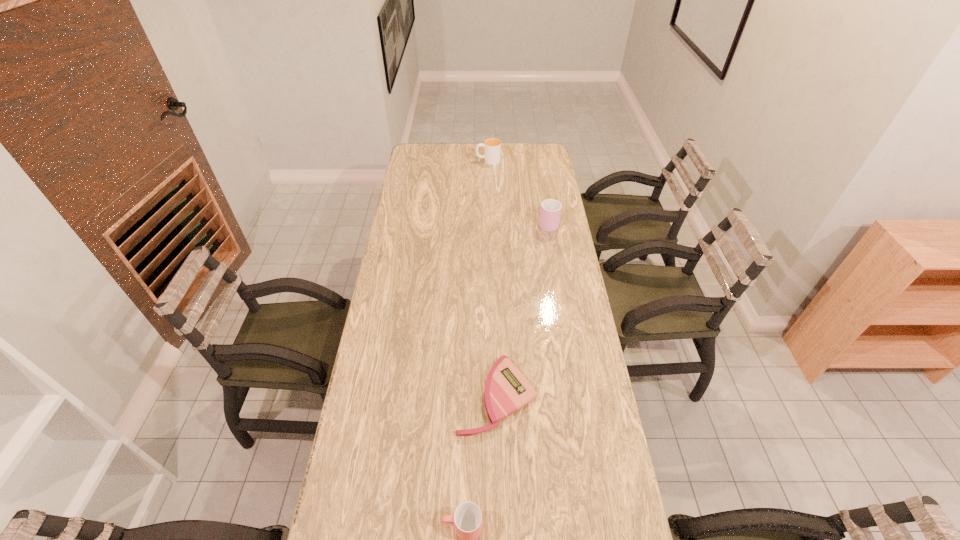
Locate an element on the screen. unoccupied position between the second nearest cup and the farthest cup is located at coordinates (518, 192).

Find the location of `vacant space that is in between the wristlet and the second farthest object`. vacant space that is in between the wristlet and the second farthest object is located at coordinates (522, 309).

This screenshot has height=540, width=960. I want to click on empty space that is in between the wristlet and the rightmost object, so click(x=522, y=309).

Identify the location of vacant area between the farthest object and the rightmost object. (518, 192).

Find the location of a particular element. object that is the closest to the rightmost object is located at coordinates (492, 146).

You are a GUI agent. You are given a task and a screenshot of the screen. Output one action in this format:
    pyautogui.click(x=<x>, y=<y>)
    Task: Click on the object that stands as the closest to the second nearest object
    
    Given the screenshot: What is the action you would take?
    pyautogui.click(x=467, y=519)

Find the location of a particular element. This screenshot has width=960, height=540. cup that is the nearest to the rightmost object is located at coordinates (492, 146).

Choose which cup is the nearest neighbor to the third tallest object. Please provide its 2D coordinates. Your answer should be formatted as a tuple, i.e. [(x, y)], where the tuple contains the x and y coordinates of a point satisfying the conditions above.

[(550, 212)]